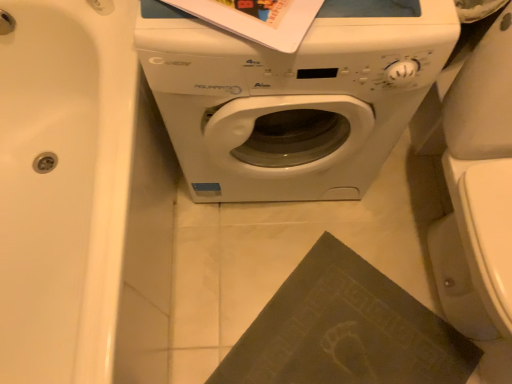
Question: Does white glossy bathtub at left turn towards white glossy washing machine at center?

Choices:
 (A) no
 (B) yes

Answer: (B)

Question: From the image's perspective, is white glossy bathtub at left below white glossy washing machine at center?

Choices:
 (A) no
 (B) yes

Answer: (B)

Question: Is white glossy bathtub at left positioned behind white glossy washing machine at center?

Choices:
 (A) no
 (B) yes

Answer: (A)

Question: Considering the relative sizes of white glossy bathtub at left and white glossy washing machine at center in the image provided, is white glossy bathtub at left taller than white glossy washing machine at center?

Choices:
 (A) no
 (B) yes

Answer: (A)

Question: Is white glossy bathtub at left at the left side of white glossy washing machine at center?

Choices:
 (A) yes
 (B) no

Answer: (A)

Question: Does white glossy bathtub at left have a lesser width compared to white glossy washing machine at center?

Choices:
 (A) yes
 (B) no

Answer: (B)

Question: Does white glossy washing machine at center have a lesser height compared to dark matte book at lower right?

Choices:
 (A) no
 (B) yes

Answer: (A)

Question: Is white glossy washing machine at center not near dark matte book at lower right?

Choices:
 (A) no
 (B) yes

Answer: (A)

Question: Is the depth of white glossy washing machine at center less than that of dark matte book at lower right?

Choices:
 (A) no
 (B) yes

Answer: (B)

Question: Is white glossy washing machine at center not within dark matte book at lower right?

Choices:
 (A) yes
 (B) no

Answer: (A)

Question: Can you see white glossy washing machine at center touching dark matte book at lower right?

Choices:
 (A) no
 (B) yes

Answer: (A)

Question: From the image's perspective, does white glossy washing machine at center appear lower than dark matte book at lower right?

Choices:
 (A) yes
 (B) no

Answer: (B)

Question: Considering the relative positions of dark matte book at lower right and white glossy bathtub at left in the image provided, is dark matte book at lower right in front of white glossy bathtub at left?

Choices:
 (A) no
 (B) yes

Answer: (A)